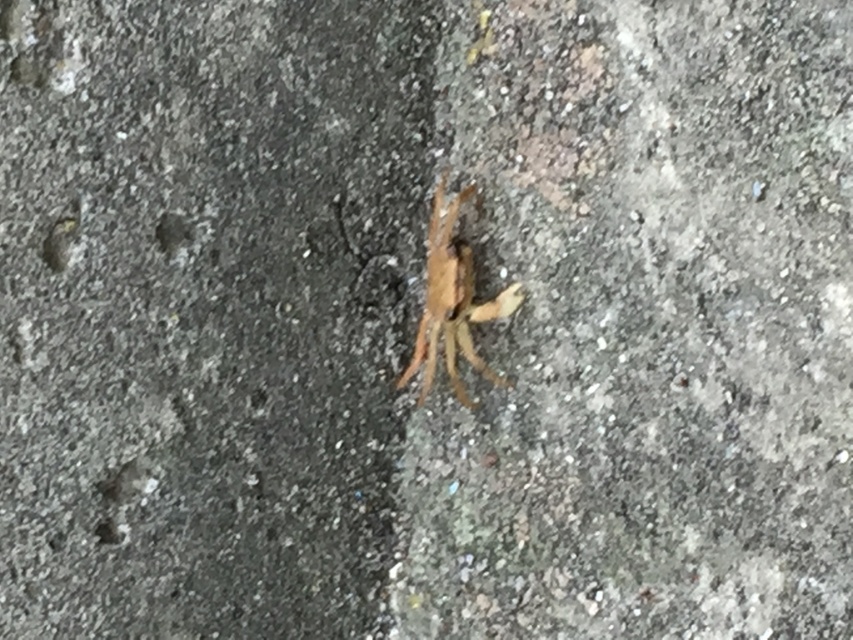
Does gray rough concrete at center appear under brown rough concrete at center?

No.

Does gray rough concrete at center lie in front of brown rough concrete at center?

Yes, gray rough concrete at center is closer to the viewer.

Between point (370, 280) and point (735, 227), which one is positioned in front?

Point (735, 227)

Where is `gray rough concrete at center`? This screenshot has height=640, width=853. gray rough concrete at center is located at coordinates (206, 310).

Based on the photo, is brown rough concrete at center shorter than brown fuzzy spider at center?

In fact, brown rough concrete at center may be taller than brown fuzzy spider at center.

Between point (738, 282) and point (469, 336), which one is positioned behind?

Point (469, 336)

Image resolution: width=853 pixels, height=640 pixels. I want to click on brown rough concrete at center, so click(x=646, y=326).

Between point (363, 45) and point (450, 234), which one is positioned behind?

Point (450, 234)

The image size is (853, 640). What do you see at coordinates (206, 310) in the screenshot?
I see `gray rough concrete at center` at bounding box center [206, 310].

This screenshot has height=640, width=853. I want to click on gray rough concrete at center, so click(206, 310).

Find the location of a particular element. The image size is (853, 640). gray rough concrete at center is located at coordinates (206, 310).